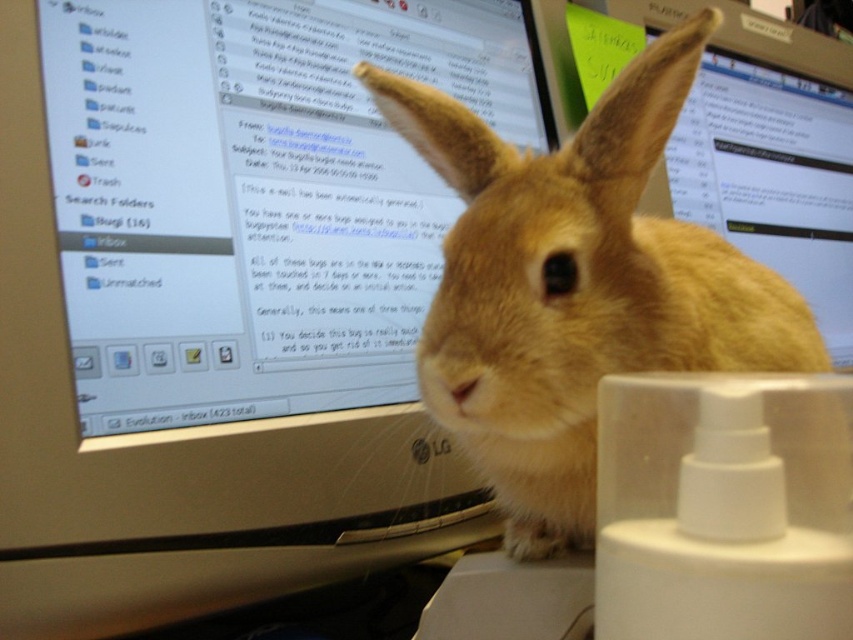
Question: Based on their relative distances, which object is farther from the matte plastic monitor at center?

Choices:
 (A) white plastic monitor at upper center
 (B) furry beige rabbit at center

Answer: (B)

Question: Does white plastic monitor at upper center come in front of matte plastic monitor at center?

Choices:
 (A) no
 (B) yes

Answer: (B)

Question: Which point appears closest to the camera in this image?

Choices:
 (A) (270, 572)
 (B) (685, 140)
 (C) (572, 500)

Answer: (C)

Question: Does white plastic monitor at upper center have a greater width compared to furry beige rabbit at center?

Choices:
 (A) yes
 (B) no

Answer: (A)

Question: Is furry beige rabbit at center to the left of matte plastic monitor at center from the viewer's perspective?

Choices:
 (A) no
 (B) yes

Answer: (B)

Question: Which point is farther from the camera taking this photo?

Choices:
 (A) 709,67
 (B) 685,96
 (C) 122,376

Answer: (A)